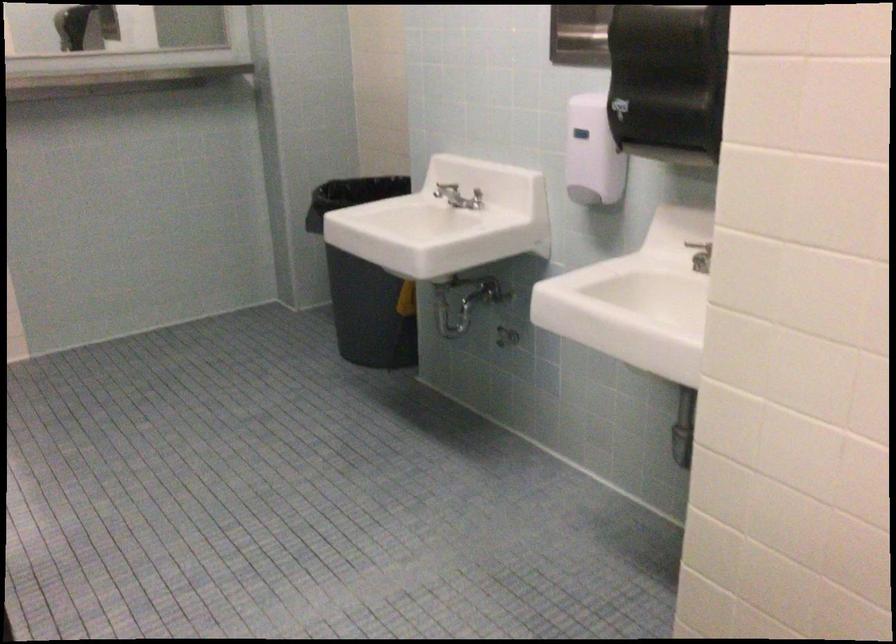
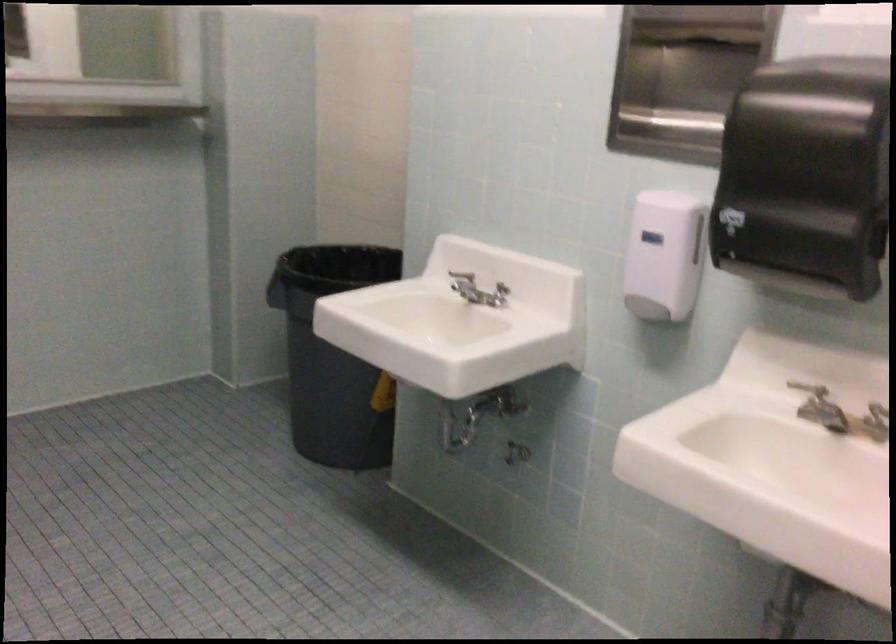
Where in the second image is the point corresponding to (452,185) from the first image?

(462, 275)